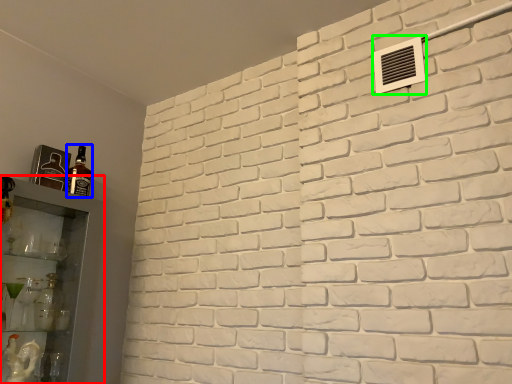
Question: Estimate the real-world distances between objects in this image. Which object is farther from shelf (highlighted by a red box), bottle (highlighted by a blue box) or air conditioning (highlighted by a green box)?

Choices:
 (A) bottle
 (B) air conditioning

Answer: (B)